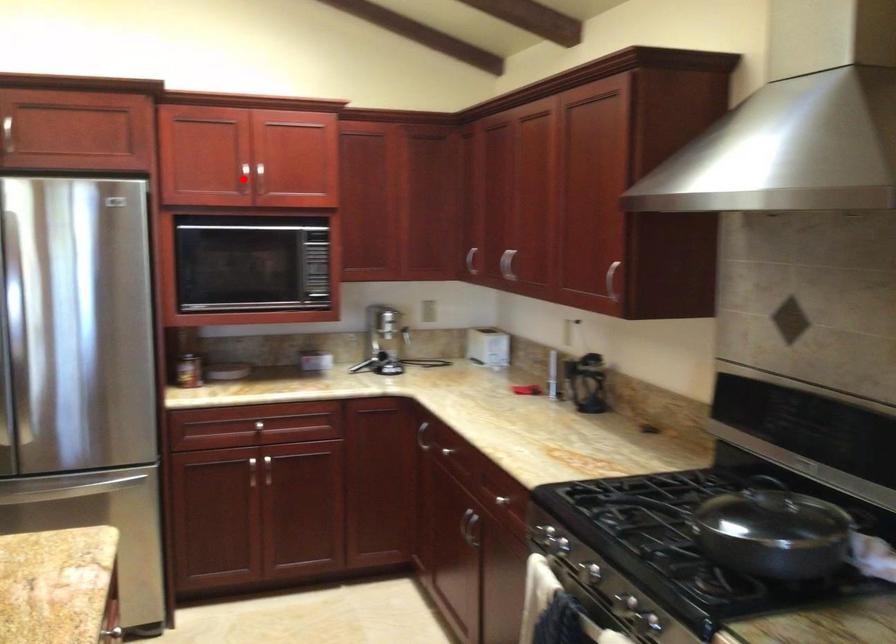
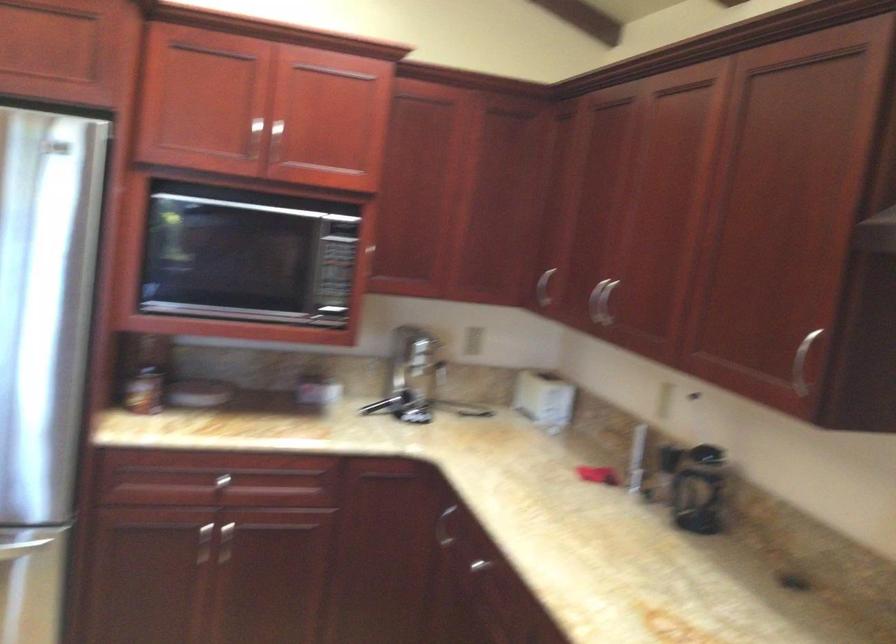
Question: A red point is marked in image1. In image2, is the corresponding 3D point closer to the camera or farther? Reply with the corresponding letter.

Choices:
 (A) The corresponding 3D point is closer.
 (B) The corresponding 3D point is farther.

Answer: (A)